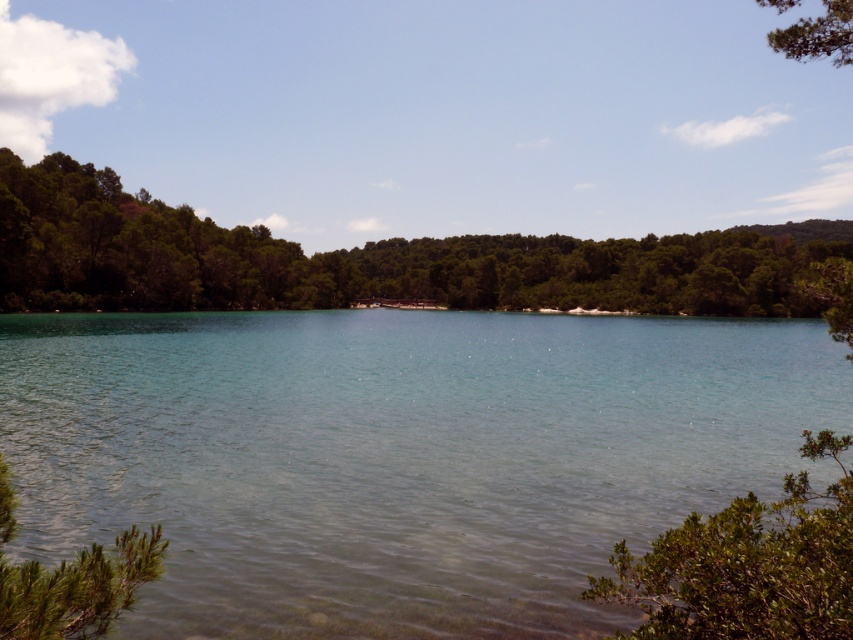
Question: Does green leafy shrub at lower left have a greater width compared to green textured tree at upper right?

Choices:
 (A) yes
 (B) no

Answer: (B)

Question: Does green leafy shrub at lower left appear under green textured tree at upper right?

Choices:
 (A) yes
 (B) no

Answer: (A)

Question: Which is nearer to the green textured tree at upper right?

Choices:
 (A) clear water at center
 (B) green leafy shrub at lower left
 (C) green leafy tree at left

Answer: (A)

Question: Is green leafy tree at left wider than green textured tree at upper right?

Choices:
 (A) no
 (B) yes

Answer: (A)

Question: Which point is farther to the camera?

Choices:
 (A) clear water at center
 (B) green textured tree at upper right

Answer: (A)

Question: Which of the following is the closest to the observer?

Choices:
 (A) clear water at center
 (B) green leafy shrub at lower left
 (C) green textured tree at upper right

Answer: (B)